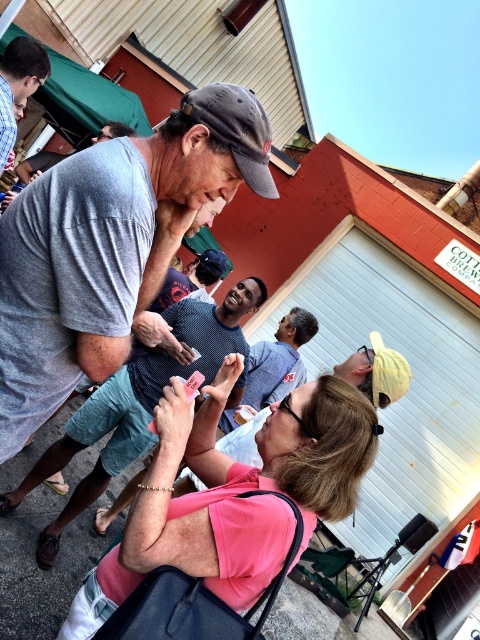
Question: Is gray cotton t-shirt at center below matte black phone at center?

Choices:
 (A) yes
 (B) no

Answer: (B)

Question: Estimate the real-world distances between objects in this image. Which object is farther from the gray cotton t-shirt at center?

Choices:
 (A) matte black phone at center
 (B) dark gray fabric baseball cap at center
 (C) pink matte shirt at center
 (D) matte gray shirt at center

Answer: (D)

Question: Which point is farther to the camera?

Choices:
 (A) (35, 182)
 (B) (7, 45)
 (C) (273, 566)
 (D) (240, 163)

Answer: (B)

Question: Does gray cotton t-shirt at center come behind pink matte shirt at center?

Choices:
 (A) yes
 (B) no

Answer: (A)

Question: Which of the following is the farthest from the observer?

Choices:
 (A) matte gray shirt at center
 (B) pink matte shirt at center
 (C) gray cotton t-shirt at center
 (D) matte black phone at center

Answer: (D)

Question: Considering the relative positions of dark gray fabric baseball cap at center and matte gray shirt at center in the image provided, where is dark gray fabric baseball cap at center located with respect to matte gray shirt at center?

Choices:
 (A) left
 (B) right

Answer: (B)